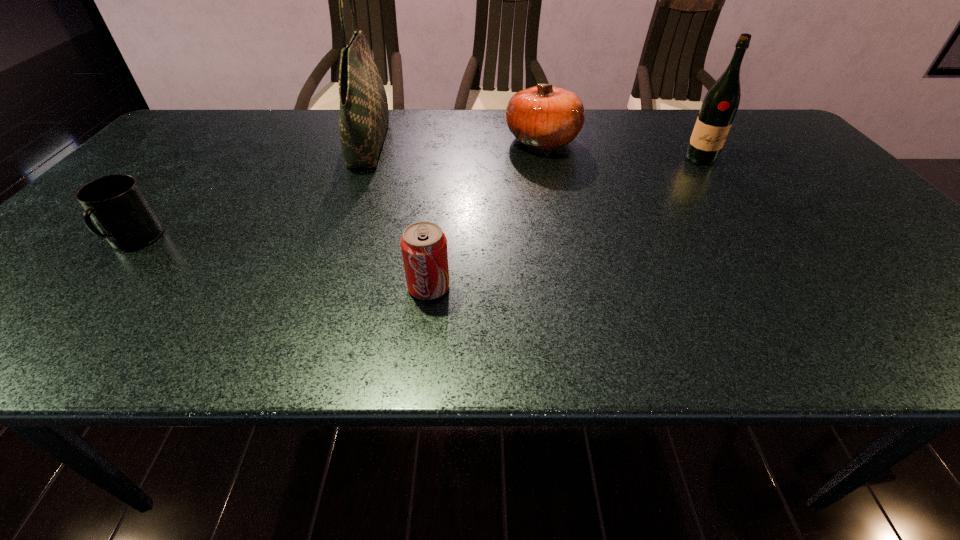
Image resolution: width=960 pixels, height=540 pixels. Find the location of `free space at the right edge of the desktop`. free space at the right edge of the desktop is located at coordinates (828, 191).

In the image, there is a desktop. Find the location of `vacant area at the far right corner`. vacant area at the far right corner is located at coordinates (741, 118).

Where is `vacant space that's between the fourth farthest object and the nearest object`? This screenshot has width=960, height=540. vacant space that's between the fourth farthest object and the nearest object is located at coordinates point(281,264).

Identify the location of free spot between the fourth object from left to right and the second tallest object. 621,150.

Identify the location of free space between the mug and the second object from right to left. (338, 191).

Find the location of a particular element. Image resolution: width=960 pixels, height=540 pixels. empty location between the nearest object and the leftmost object is located at coordinates pyautogui.click(x=281, y=264).

Locate an element on the screen. vacant point located between the pumpkin and the leftmost object is located at coordinates (338, 191).

Find the location of a particular element. unoccupied area between the mug and the pumpkin is located at coordinates (338, 191).

Where is `empty location between the second tallest object and the tallest object`? Image resolution: width=960 pixels, height=540 pixels. empty location between the second tallest object and the tallest object is located at coordinates (535, 151).

Identify the location of free space that is in between the tallest object and the rightmost object. The width and height of the screenshot is (960, 540). (535, 151).